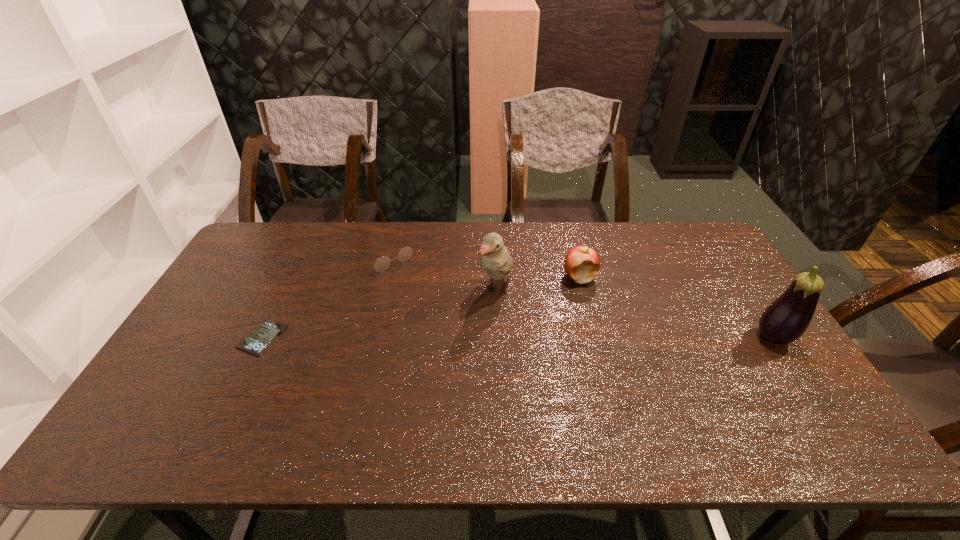
This screenshot has width=960, height=540. Find the location of `free spot on the desktop that is between the leftmost object and the eggplant and is positioned on the bitten side of the third tallest object`. free spot on the desktop that is between the leftmost object and the eggplant and is positioned on the bitten side of the third tallest object is located at coordinates (522, 338).

Identify the location of vacant space on the desktop that is between the shortest object and the rightmost object and is positioned on the temples of the second shortest object. (464, 338).

The image size is (960, 540). Find the location of `vacant space on the desktop that is between the identity card and the eggplant and is positioned at the face of the bird`. vacant space on the desktop that is between the identity card and the eggplant and is positioned at the face of the bird is located at coordinates (463, 338).